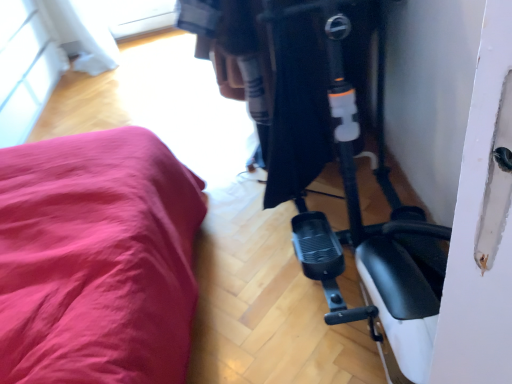
Question: Should I look upward or downward to see white matte mobility scooter at center?

Choices:
 (A) up
 (B) down

Answer: (A)